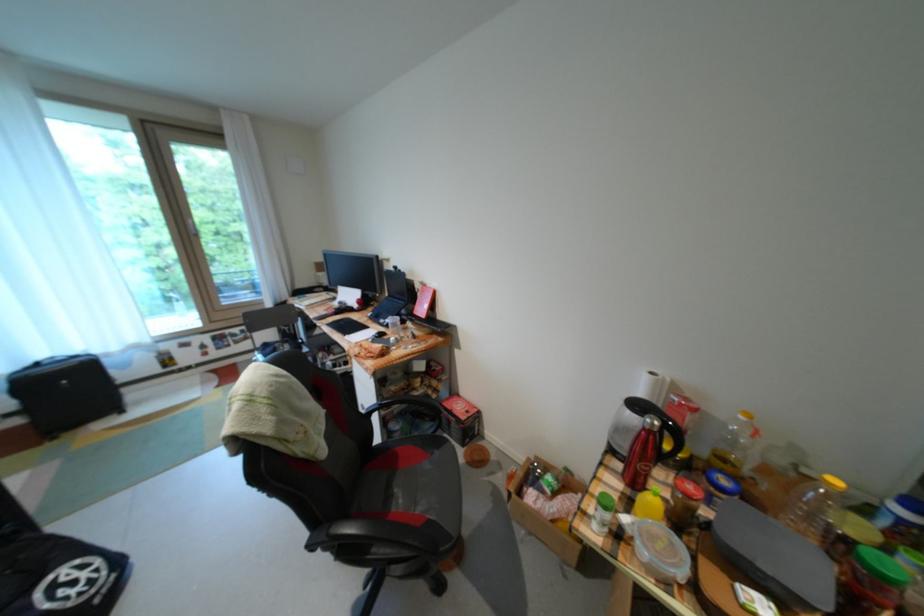
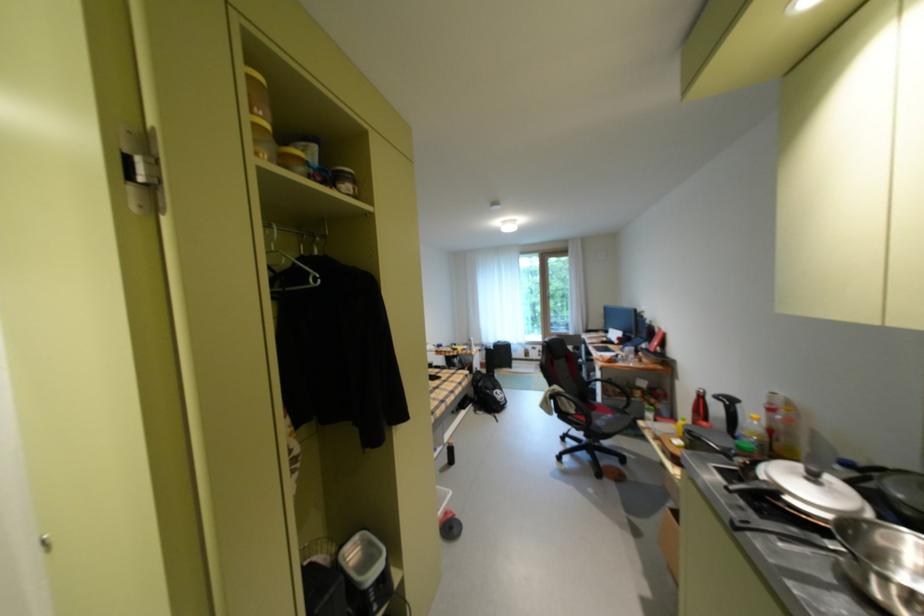
Locate, in the second image, the point that corresponds to point 446,455 in the first image.

(629, 416)